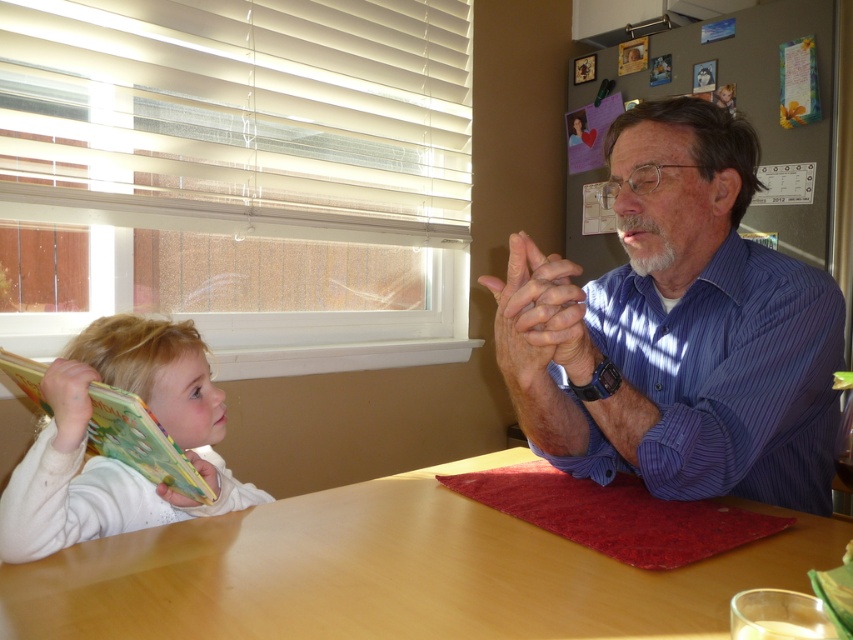
Based on the photo, you are a guest entering the room and want to sit at the wooden table at center. To avoid the sunlight coming through the white plastic blinds at upper left, where should you position yourself relative to the table?

You should sit on the side of the wooden table at center opposite the white plastic blinds at upper left to avoid the sunlight, as the blinds are above the table and the sunlight is coming through them.

You are standing in the room and want to adjust the white plastic blinds at upper left to let in more light. Based on their current position, which direction should you move them?

The white plastic blinds at upper left are positioned at point 0.161 on the x and 0.286 on the y axis. To let in more light, you should move them upwards along the y axis to a higher position.

You are trying to decide whether to place a large poster on the white plastic blinds at upper left or the wooden table at center. Based on their sizes, which surface can accommodate the poster better?

The white plastic blinds at upper left might be wider than wooden table at center, so the poster may fit better on the white plastic blinds at upper left.